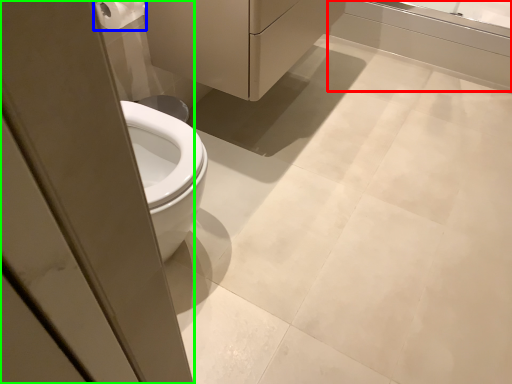
Question: Considering the real-world distances, which object is closest to bath (highlighted by a red box)? toilet paper (highlighted by a blue box) or screen door (highlighted by a green box).

Choices:
 (A) toilet paper
 (B) screen door

Answer: (A)